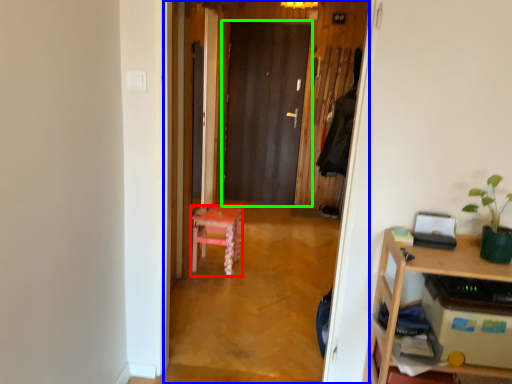
Question: Based on their relative distances, which object is nearer to stool (highlighted by a red box)? Choose from corridor (highlighted by a blue box) and door (highlighted by a green box).

Choices:
 (A) corridor
 (B) door

Answer: (A)